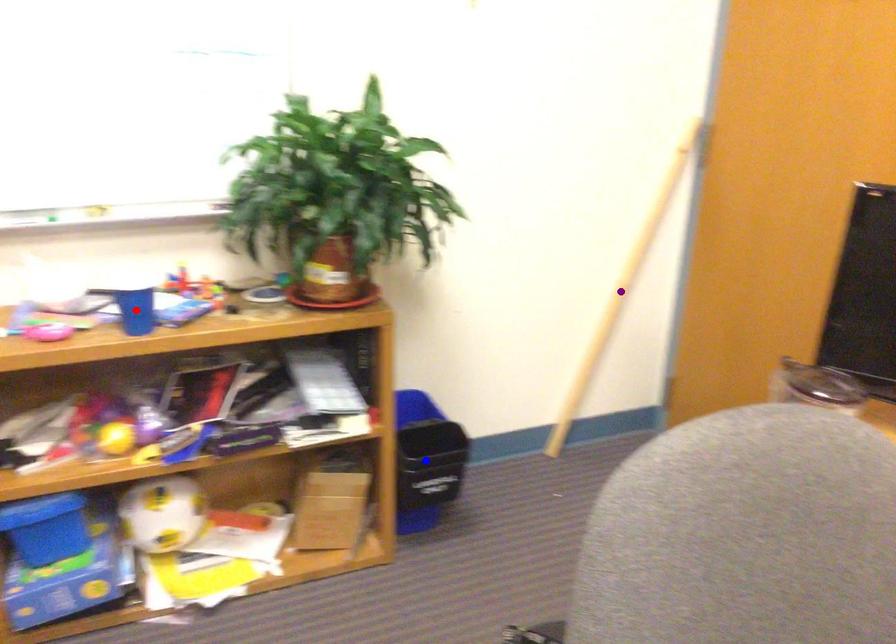
Order these from nearest to farthest:
1. purple point
2. blue point
3. red point

1. red point
2. blue point
3. purple point